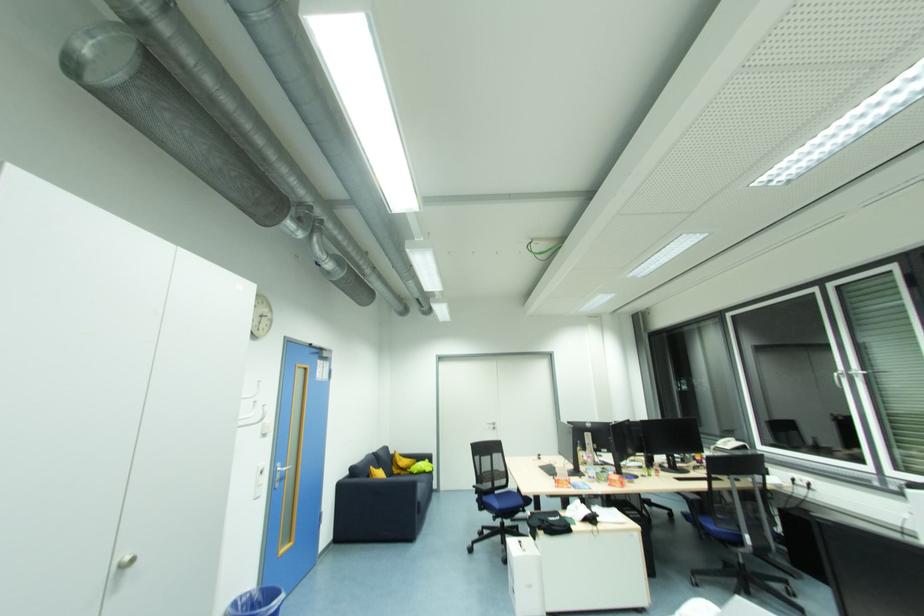
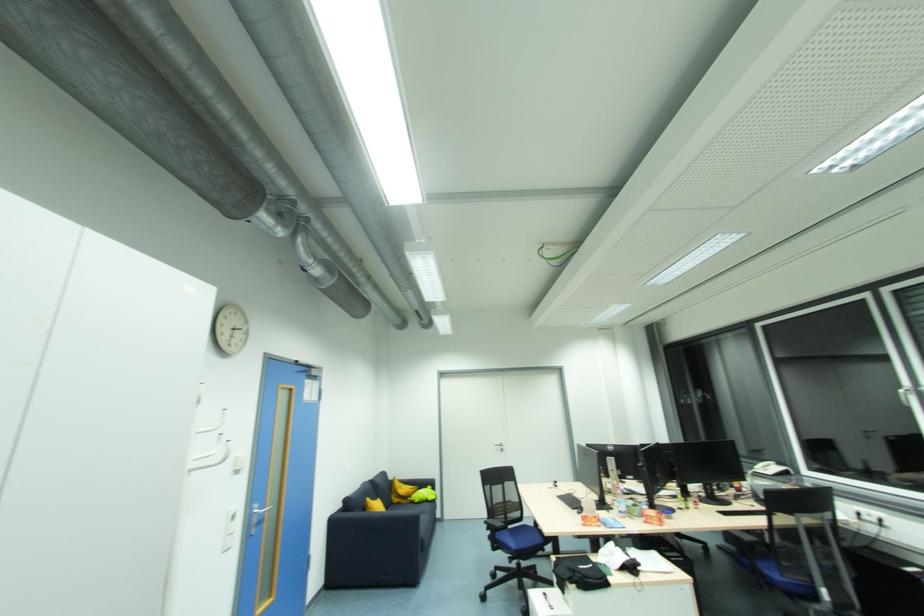
The point at (398, 472) is marked in the first image. Where is the corresponding point in the second image?

(397, 501)